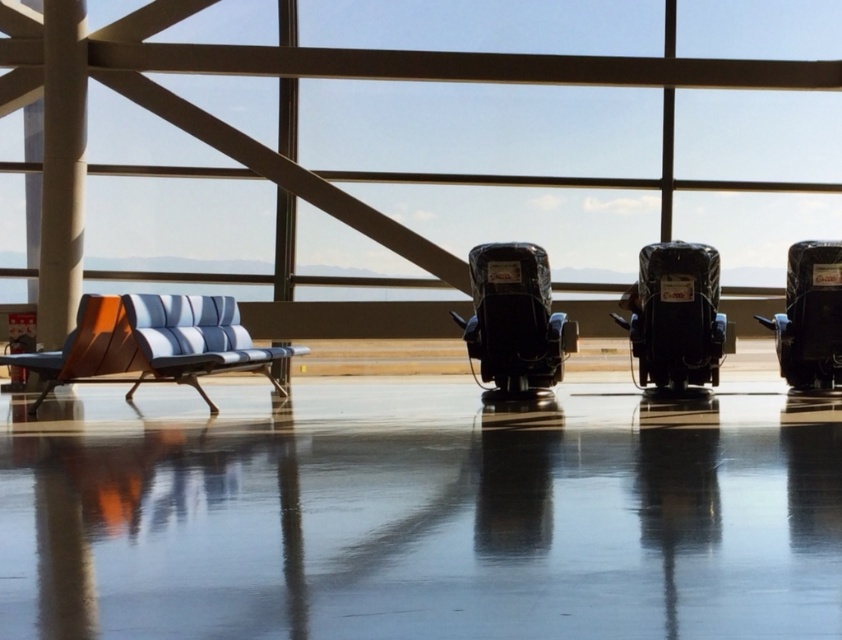
Who is positioned more to the right, matte black beach chair at center or blue striped fabric bench at left?

matte black beach chair at center is more to the right.

How much distance is there between matte black beach chair at center and blue striped fabric bench at left?

matte black beach chair at center and blue striped fabric bench at left are 4.00 meters apart from each other.

Between point (686, 291) and point (221, 362), which one is positioned behind?

Positioned behind is point (686, 291).

Locate an element on the screen. matte black beach chair at center is located at coordinates (675, 316).

Is point (542, 310) closer to viewer compared to point (99, 310)?

No, (542, 310) is further to viewer.

Does black plastic baby carriage at center appear on the left side of wooden beach chair at left?

In fact, black plastic baby carriage at center is to the right of wooden beach chair at left.

Image resolution: width=842 pixels, height=640 pixels. In order to click on black plastic baby carriage at center in this screenshot , I will do `click(514, 320)`.

Find the location of `black plastic baby carriage at center`. black plastic baby carriage at center is located at coordinates (514, 320).

Which is above, black plastic beach chair at right or wooden beach chair at left?

Positioned higher is black plastic beach chair at right.

Between black plastic beach chair at right and wooden beach chair at left, which one has more height?

Standing taller between the two is black plastic beach chair at right.

Describe the element at coordinates (809, 316) in the screenshot. I see `black plastic beach chair at right` at that location.

Find the location of a particular element. This screenshot has height=640, width=842. black plastic beach chair at right is located at coordinates (809, 316).